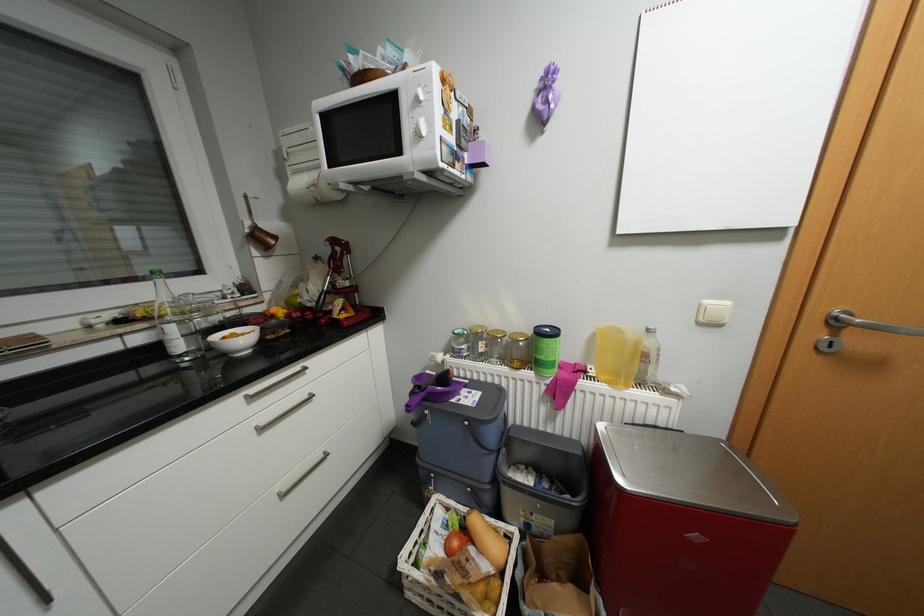
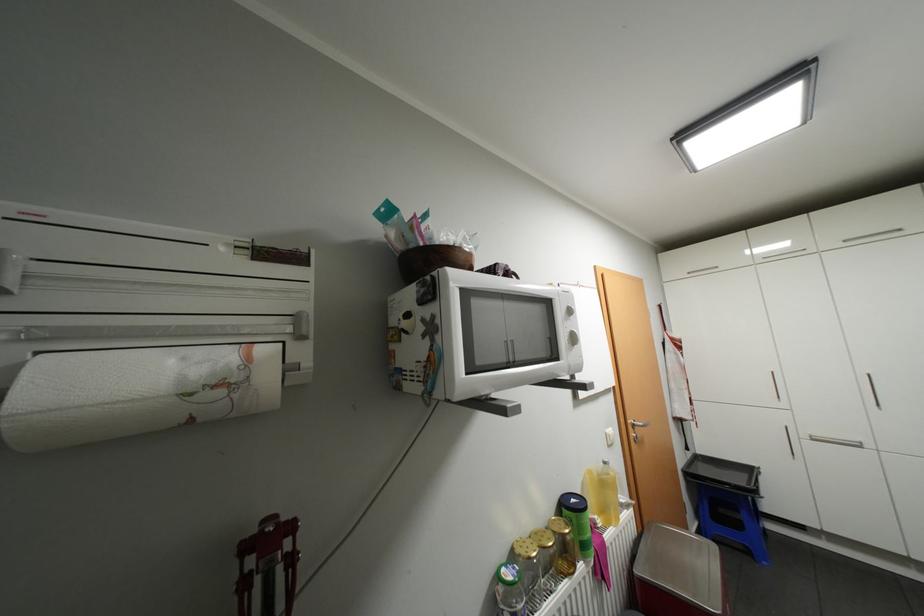
The point at (327, 175) is marked in the first image. Where is the corresponding point in the second image?

(256, 358)